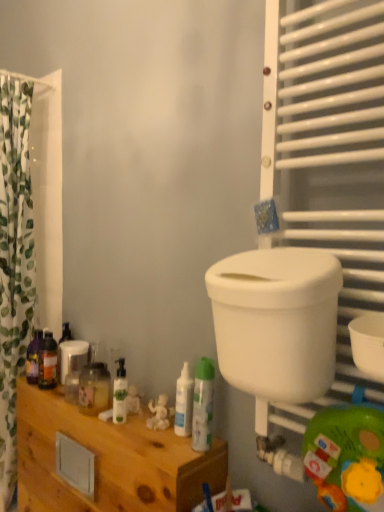
Question: Is translucent plastic bottle at left, which is the fifth toiletry from front to back, in front of or behind white plastic toilet bowl at right in the image?

Choices:
 (A) behind
 (B) front

Answer: (A)

Question: Considering the positions of translucent plastic bottle at left, which is the fifth toiletry from right to left, and white plastic toilet bowl at right in the image, is translucent plastic bottle at left, which is the fifth toiletry from right to left, bigger or smaller than white plastic toilet bowl at right?

Choices:
 (A) big
 (B) small

Answer: (B)

Question: Based on their relative distances, which object is farther from the translucent plastic bottles at lower left, the second toiletry in the back-to-front sequence?

Choices:
 (A) translucent plastic bottle at left, which is the fifth toiletry from front to back
 (B) white plastic toilet bowl at right
 (C) green leaf-patterned fabric at left
 (D) white glossy spray can at center, arranged as the 5th toiletry when viewed from the back
 (E) wooden cabinet at lower left

Answer: (B)

Question: Estimate the real-world distances between objects in this image. Which object is farther from the white glossy pump bottle at center, the 3th toiletry when ordered from left to right?

Choices:
 (A) wooden cabinet at lower left
 (B) white glossy bottle at center, the 2th toiletry viewed from the right
 (C) white glossy spray can at center, the 1th toiletry from the right
 (D) translucent plastic bottle at left, which is the fifth toiletry from front to back
 (E) green leaf-patterned fabric at left

Answer: (E)